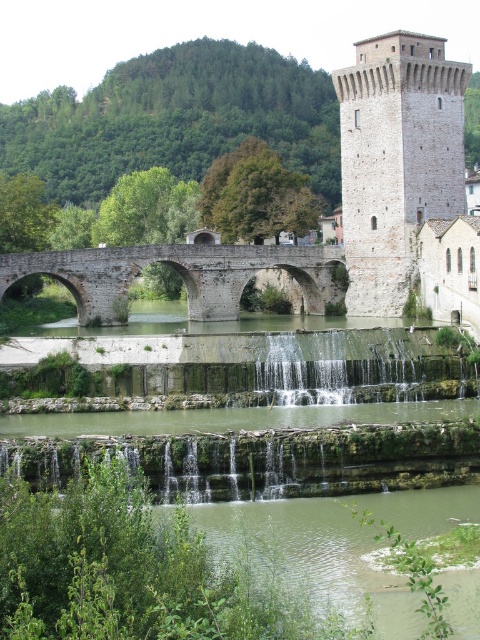
Question: Which object appears closest to the camera in this image?

Choices:
 (A) stone arch bridge at center
 (B) white stone tower at upper right
 (C) stone tower at center

Answer: (A)

Question: Does stone tower at center have a lesser width compared to white stone tower at upper right?

Choices:
 (A) no
 (B) yes

Answer: (A)

Question: Does stone tower at center appear under stone arch bridge at center?

Choices:
 (A) no
 (B) yes

Answer: (A)

Question: Among these points, which one is nearest to the camera?

Choices:
 (A) (300, 262)
 (B) (362, 136)

Answer: (B)

Question: Estimate the real-world distances between objects in this image. Which object is farther from the stone arch bridge at center?

Choices:
 (A) stone tower at center
 (B) white stone tower at upper right

Answer: (B)

Question: Can you confirm if white stone tower at upper right is positioned above stone arch bridge at center?

Choices:
 (A) no
 (B) yes

Answer: (B)